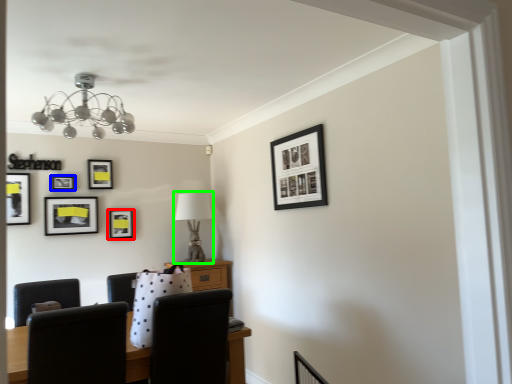
Question: Which object is positioned farthest from picture frame (highlighted by a red box)? Select from picture frame (highlighted by a blue box) and table lamp (highlighted by a green box).

Choices:
 (A) picture frame
 (B) table lamp

Answer: (B)